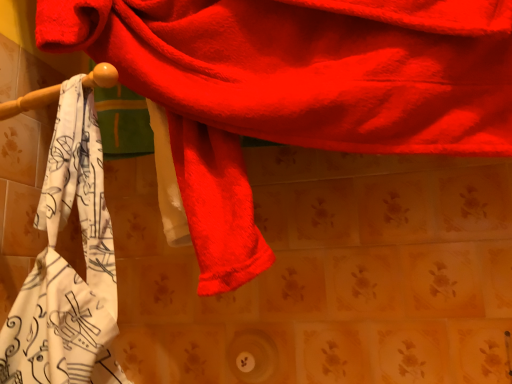
Question: Does fluffy red towel at upper center, which is the 2th towel from left to right, contain white printed towel at left, which appears as the 1th towel when viewed from the left?

Choices:
 (A) yes
 (B) no

Answer: (A)

Question: Is fluffy red towel at upper center, which ranks as the 1th towel in right-to-left order, closer to the viewer compared to white printed towel at left, which appears as the 1th towel when viewed from the left?

Choices:
 (A) no
 (B) yes

Answer: (B)

Question: Is there a large distance between fluffy red towel at upper center, which ranks as the 1th towel in right-to-left order, and white printed towel at left, positioned as the second towel in right-to-left order?

Choices:
 (A) yes
 (B) no

Answer: (B)

Question: Is fluffy red towel at upper center, which ranks as the 1th towel in right-to-left order, further to camera compared to white printed towel at left, which appears as the 1th towel when viewed from the left?

Choices:
 (A) yes
 (B) no

Answer: (B)

Question: Is fluffy red towel at upper center, which ranks as the 1th towel in right-to-left order, smaller than white printed towel at left, which appears as the 1th towel when viewed from the left?

Choices:
 (A) yes
 (B) no

Answer: (B)

Question: Does fluffy red towel at upper center, which is the 2th towel from left to right, have a larger size compared to white printed towel at left, positioned as the second towel in right-to-left order?

Choices:
 (A) yes
 (B) no

Answer: (A)

Question: Is white printed towel at left, which appears as the 1th towel when viewed from the left, turned away from fluffy red towel at upper center, which ranks as the 1th towel in right-to-left order?

Choices:
 (A) yes
 (B) no

Answer: (A)

Question: Does white printed towel at left, positioned as the second towel in right-to-left order, have a lesser height compared to fluffy red towel at upper center, which ranks as the 1th towel in right-to-left order?

Choices:
 (A) no
 (B) yes

Answer: (B)

Question: From a real-world perspective, is white printed towel at left, positioned as the second towel in right-to-left order, positioned under fluffy red towel at upper center, which is the 2th towel from left to right, based on gravity?

Choices:
 (A) no
 (B) yes

Answer: (B)

Question: Is white printed towel at left, which appears as the 1th towel when viewed from the left, oriented towards fluffy red towel at upper center, which ranks as the 1th towel in right-to-left order?

Choices:
 (A) yes
 (B) no

Answer: (A)

Question: Is white printed towel at left, positioned as the second towel in right-to-left order, far away from fluffy red towel at upper center, which ranks as the 1th towel in right-to-left order?

Choices:
 (A) no
 (B) yes

Answer: (A)

Question: Is white printed towel at left, which appears as the 1th towel when viewed from the left, positioned behind fluffy red towel at upper center, which ranks as the 1th towel in right-to-left order?

Choices:
 (A) no
 (B) yes

Answer: (B)

Question: In terms of height, does fluffy red towel at upper center, which ranks as the 1th towel in right-to-left order, look taller or shorter compared to white printed towel at left, positioned as the second towel in right-to-left order?

Choices:
 (A) tall
 (B) short

Answer: (A)